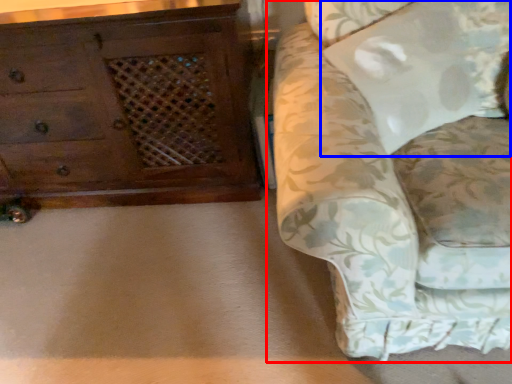
Question: Which of the following is the closest to the observer, studio couch (highlighted by a red box) or pillow (highlighted by a blue box)?

Choices:
 (A) studio couch
 (B) pillow

Answer: (A)